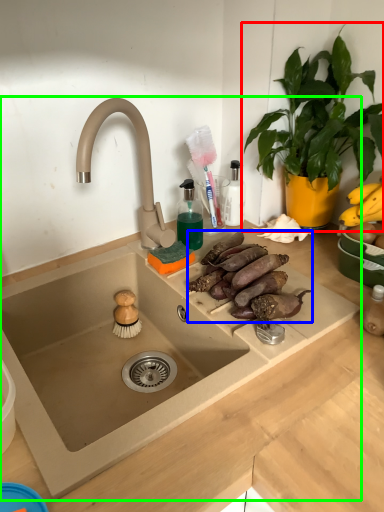
Question: Which is farther away from houseplant (highlighted by a red box)? food (highlighted by a blue box) or sink (highlighted by a green box)?

Choices:
 (A) food
 (B) sink

Answer: (B)